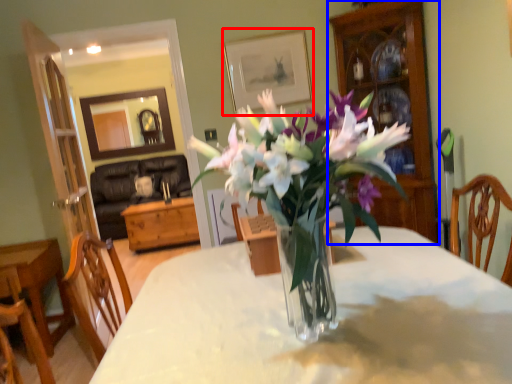
Question: Which point is further to the camera, picture frame (highlighted by a red box) or cabinetry (highlighted by a blue box)?

Choices:
 (A) picture frame
 (B) cabinetry

Answer: (A)